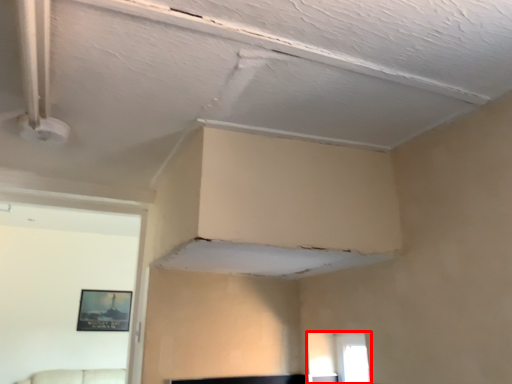
Question: From the image's perspective, what is the correct spatial relationship of window (annotated by the red box) in relation to picture frame?

Choices:
 (A) above
 (B) below

Answer: (A)